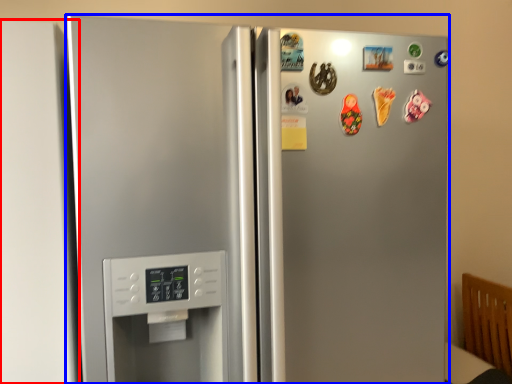
Question: Which object is further to the camera taking this photo, door (highlighted by a red box) or refrigerator (highlighted by a blue box)?

Choices:
 (A) door
 (B) refrigerator

Answer: (A)